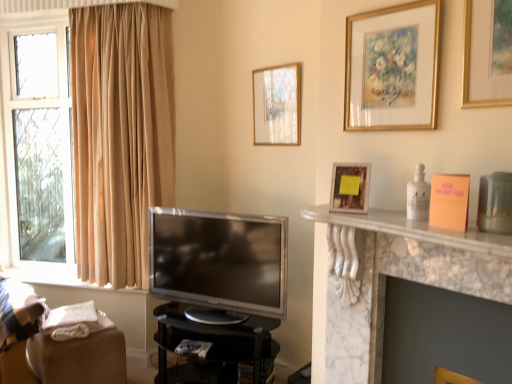
Question: Is gold-framed painting at upper center, which appears as the third picture frame when viewed from the left, to the right of wooden photo frame at upper right, arranged as the 2th picture frame when viewed from the right, from the viewer's perspective?

Choices:
 (A) yes
 (B) no

Answer: (A)

Question: Is gold-framed painting at upper center, positioned as the third picture frame in back-to-front order, further to camera compared to wooden photo frame at upper right, arranged as the 2th picture frame when viewed from the right?

Choices:
 (A) no
 (B) yes

Answer: (A)

Question: From the image's perspective, is gold-framed painting at upper center, positioned as the third picture frame in back-to-front order, located above wooden photo frame at upper right, which appears as the 2th picture frame when viewed from the back?

Choices:
 (A) yes
 (B) no

Answer: (A)

Question: Considering the relative sizes of gold-framed painting at upper center, which appears as the third picture frame when viewed from the left, and wooden photo frame at upper right, marked as the second picture frame in a left-to-right arrangement, in the image provided, is gold-framed painting at upper center, which appears as the third picture frame when viewed from the left, thinner than wooden photo frame at upper right, marked as the second picture frame in a left-to-right arrangement,?

Choices:
 (A) no
 (B) yes

Answer: (B)

Question: Does gold-framed painting at upper center, positioned as the 1th picture frame in front-to-back order, have a lesser height compared to wooden photo frame at upper right, arranged as the 2th picture frame when viewed from the right?

Choices:
 (A) yes
 (B) no

Answer: (B)

Question: From a real-world perspective, relative to matte gold picture frame at upper center, arranged as the third picture frame when viewed from the right, is matte plastic book at lower center vertically above or below?

Choices:
 (A) above
 (B) below

Answer: (B)

Question: From the image's perspective, is matte plastic book at lower center above or below matte gold picture frame at upper center, the third picture frame positioned from the front?

Choices:
 (A) above
 (B) below

Answer: (B)

Question: Visually, is matte plastic book at lower center positioned to the left or to the right of matte gold picture frame at upper center, the third picture frame positioned from the front?

Choices:
 (A) right
 (B) left

Answer: (B)

Question: Is matte plastic book at lower center bigger or smaller than matte gold picture frame at upper center, which ranks as the first picture frame in back-to-front order?

Choices:
 (A) big
 (B) small

Answer: (B)

Question: From a real-world perspective, is matte gold picture frame at upper center, which ranks as the first picture frame in back-to-front order, positioned above or below gold-framed painting at upper center, positioned as the 1th picture frame in front-to-back order?

Choices:
 (A) below
 (B) above

Answer: (A)

Question: Is matte gold picture frame at upper center, marked as the 1th picture frame in a left-to-right arrangement, inside or outside of gold-framed painting at upper center, positioned as the 1th picture frame in front-to-back order?

Choices:
 (A) inside
 (B) outside

Answer: (B)

Question: From their relative heights in the image, would you say matte gold picture frame at upper center, arranged as the third picture frame when viewed from the right, is taller or shorter than gold-framed painting at upper center, placed as the first picture frame when sorted from right to left?

Choices:
 (A) short
 (B) tall

Answer: (A)

Question: Is point (279, 91) positioned closer to the camera than point (362, 39)?

Choices:
 (A) closer
 (B) farther

Answer: (B)

Question: Considering the positions of matte gold picture frame at upper center, which ranks as the first picture frame in back-to-front order, and matte plastic book at lower center in the image, is matte gold picture frame at upper center, which ranks as the first picture frame in back-to-front order, wider or thinner than matte plastic book at lower center?

Choices:
 (A) wide
 (B) thin

Answer: (B)

Question: Considering the positions of matte gold picture frame at upper center, which ranks as the first picture frame in back-to-front order, and matte plastic book at lower center in the image, is matte gold picture frame at upper center, which ranks as the first picture frame in back-to-front order, taller or shorter than matte plastic book at lower center?

Choices:
 (A) tall
 (B) short

Answer: (A)